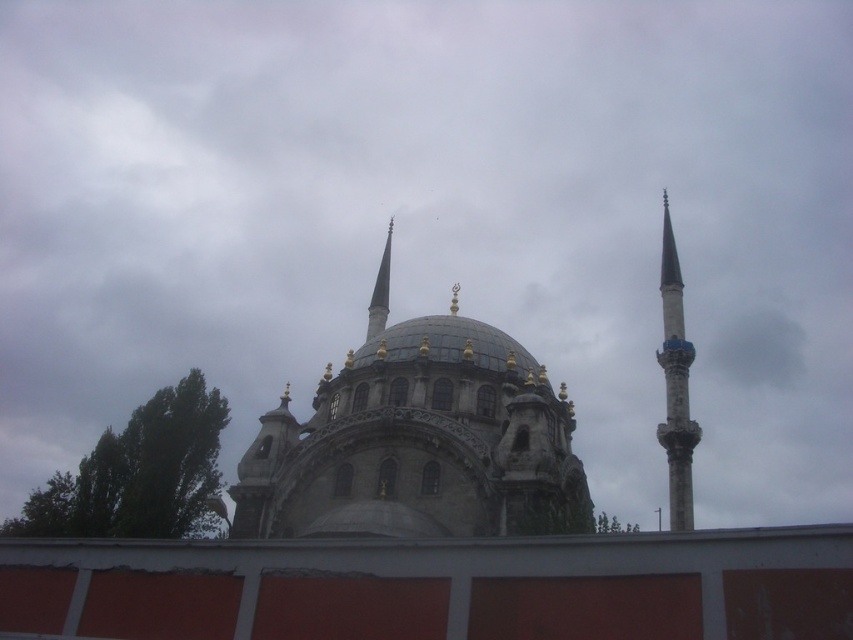
Question: Considering the relative positions of blue glossy minaret at right and smooth white spire at center in the image provided, where is blue glossy minaret at right located with respect to smooth white spire at center?

Choices:
 (A) above
 (B) below

Answer: (B)

Question: Which point is closer to the camera taking this photo?

Choices:
 (A) (378, 307)
 (B) (668, 435)
 (C) (297, 528)

Answer: (C)

Question: Considering the real-world distances, which object is closest to the blue stone dome at center?

Choices:
 (A) blue glossy minaret at right
 (B) smooth white spire at center

Answer: (B)

Question: Can you confirm if blue glossy minaret at right is bigger than smooth white spire at center?

Choices:
 (A) no
 (B) yes

Answer: (B)

Question: From the image, what is the correct spatial relationship of blue stone dome at center in relation to smooth white spire at center?

Choices:
 (A) below
 (B) above

Answer: (A)

Question: Which object appears farthest from the camera in this image?

Choices:
 (A) blue glossy minaret at right
 (B) blue stone dome at center

Answer: (A)